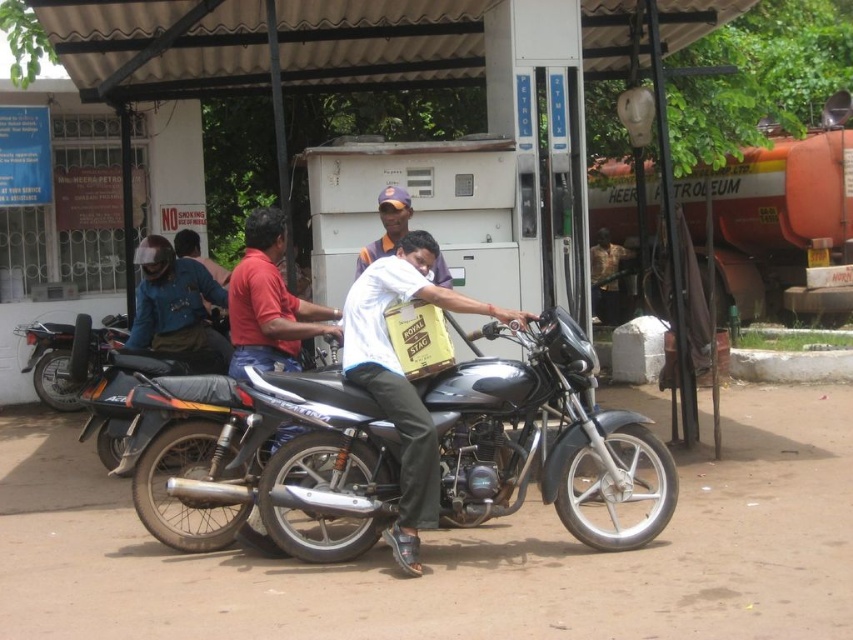
You are a photographer trying to capture a clear photo of both the shiny black motorcycle at center and the white matte shirt at center. Since you want both subjects to appear equally prominent in the photo, which one should you zoom in on more?

The shiny black motorcycle at center is larger in size than white matte shirt at center, so you should zoom in more on the white matte shirt at center to make both appear equally prominent in the photo.

You are a photographer standing at the petrol station. You want to take a picture of the black matte motorcycle at left and the white cotton shirt at center. From your position, which object appears closer to the bottom of the frame?

The black matte motorcycle at left appears closer to the bottom of the frame because it is positioned below the white cotton shirt at center.